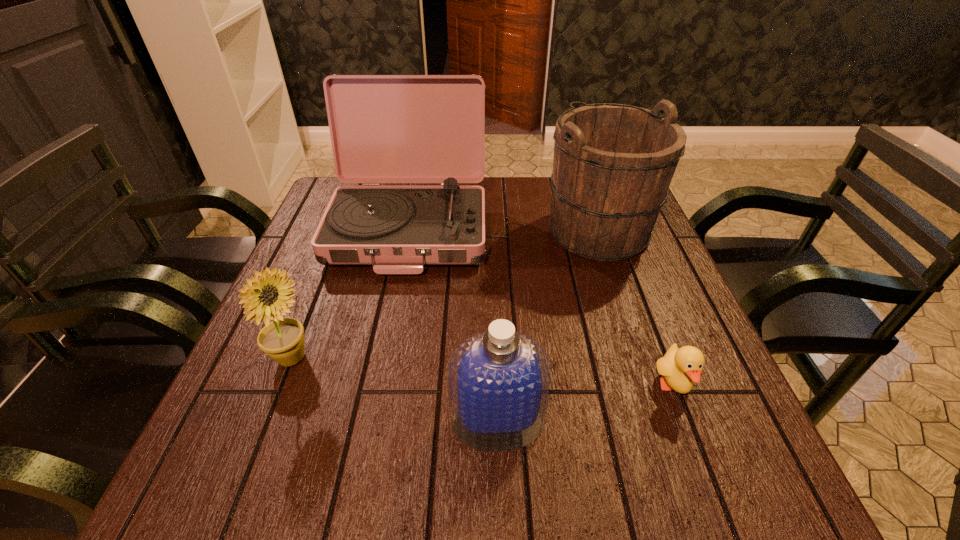
At what (x,y) coordinates should I click in order to perform the action: click on record player. Please return your answer as a coordinate pair (x, y). This screenshot has height=540, width=960. Looking at the image, I should click on (384, 128).

Locate an element on the screen. Image resolution: width=960 pixels, height=540 pixels. bucket is located at coordinates (613, 163).

At what (x,y) coordinates should I click in order to perform the action: click on cleansing agent. Please return your answer as a coordinate pair (x, y). The width and height of the screenshot is (960, 540). Looking at the image, I should click on (499, 381).

Identify the location of sunflower. (282, 339).

I want to click on duckling, so click(680, 368).

Where is `vacant space located with the lid open on the record player`? Image resolution: width=960 pixels, height=540 pixels. vacant space located with the lid open on the record player is located at coordinates (391, 323).

Where is `free space located on the left of the bucket`? The image size is (960, 540). free space located on the left of the bucket is located at coordinates (450, 230).

Find the location of a particular element. The image size is (960, 540). free spot located on the left of the cleansing agent is located at coordinates point(276,422).

This screenshot has width=960, height=540. Identify the location of vacant space located 0.120m on the face of the sunflower. (373, 359).

At what (x,y) coordinates should I click in order to perform the action: click on vacant region located 0.090m on the front-facing side of the shortest object. Please return your answer as a coordinate pair (x, y). Image resolution: width=960 pixels, height=540 pixels. Looking at the image, I should click on (701, 460).